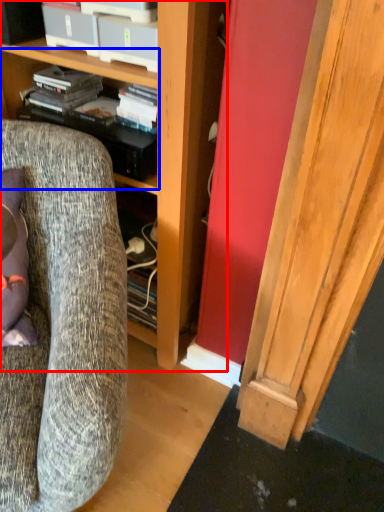
Question: Which object appears farthest to the camera in this image, cabinetry (highlighted by a red box) or shelf (highlighted by a blue box)?

Choices:
 (A) cabinetry
 (B) shelf

Answer: (B)